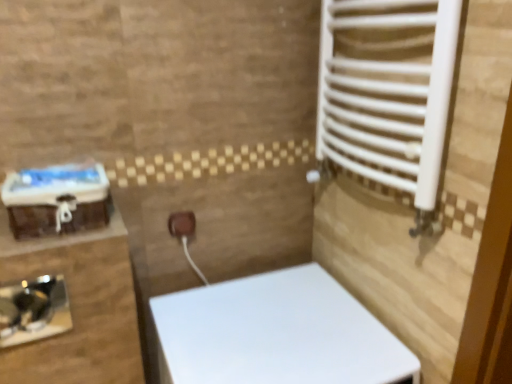
Question: From a real-world perspective, is white glossy toilet at center positioned above or below brown matte electric outlet at center?

Choices:
 (A) above
 (B) below

Answer: (B)

Question: From the image's perspective, is white glossy toilet at center positioned above or below brown matte electric outlet at center?

Choices:
 (A) below
 (B) above

Answer: (A)

Question: Which is nearer to the brown matte electric outlet at center?

Choices:
 (A) white glossy toilet at center
 (B) black glossy sink at lower left

Answer: (A)

Question: Which of these objects is positioned farthest from the black glossy sink at lower left?

Choices:
 (A) white glossy toilet at center
 (B) brown matte electric outlet at center

Answer: (A)